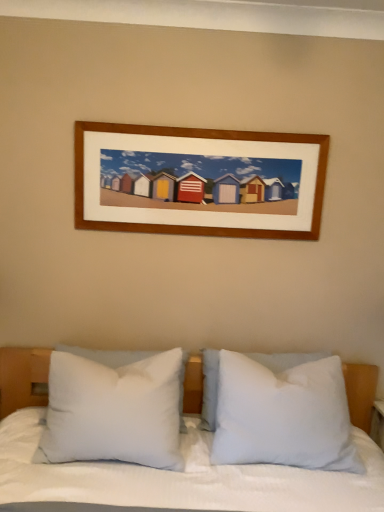
Question: In the image, is white soft pillow at center, arranged as the 3th pillow when viewed from the left, positioned in front of or behind white soft pillow at center, the third pillow positioned from the right?

Choices:
 (A) front
 (B) behind

Answer: (B)

Question: From their relative heights in the image, would you say white soft pillow at center, the 1th pillow in the right-to-left sequence, is taller or shorter than white soft pillow at center, the 1th pillow when ordered from left to right?

Choices:
 (A) short
 (B) tall

Answer: (B)

Question: Estimate the real-world distances between objects in this image. Which object is farther from the white soft pillow at center, arranged as the 3th pillow when viewed from the left?

Choices:
 (A) white soft pillow at center, arranged as the 2th pillow when viewed from the left
 (B) white soft pillow at center, the 1th pillow when ordered from left to right

Answer: (B)

Question: Estimate the real-world distances between objects in this image. Which object is closer to the white soft pillow at center, arranged as the 3th pillow when viewed from the left?

Choices:
 (A) white soft pillow at center, the 1th pillow when ordered from left to right
 (B) white soft pillow at center, arranged as the 2th pillow when viewed from the left

Answer: (B)